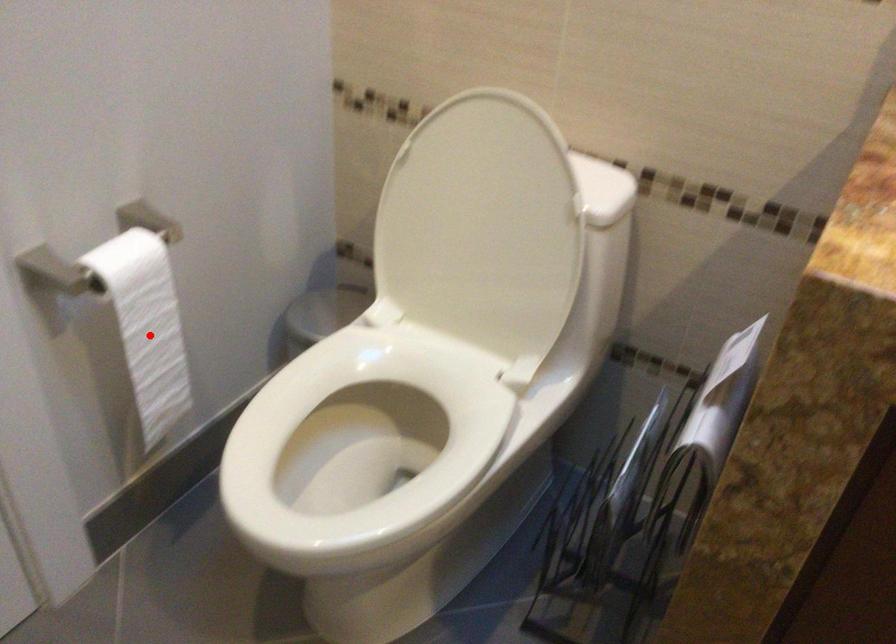
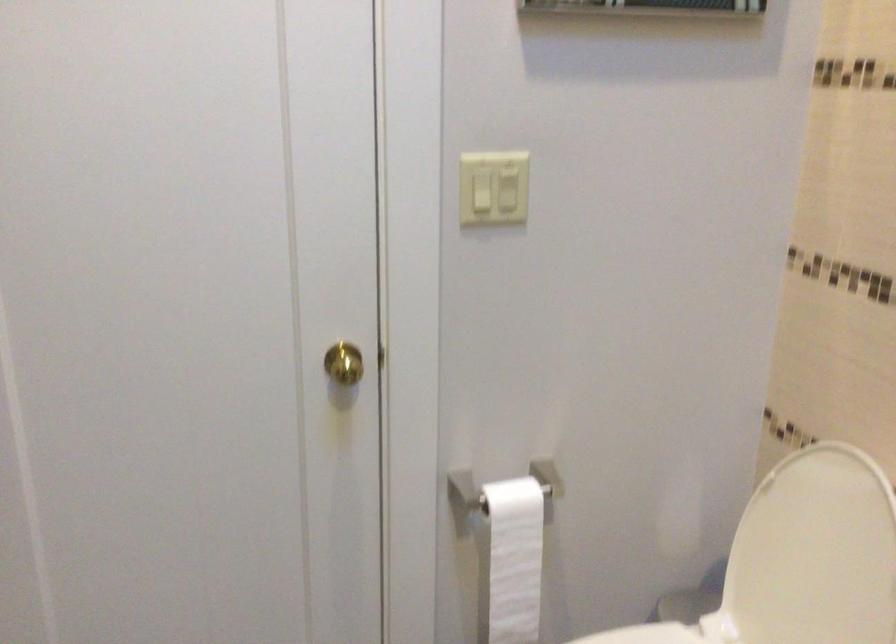
Where in the second image is the point corresponding to the highlighted location from the first image?

(513, 560)